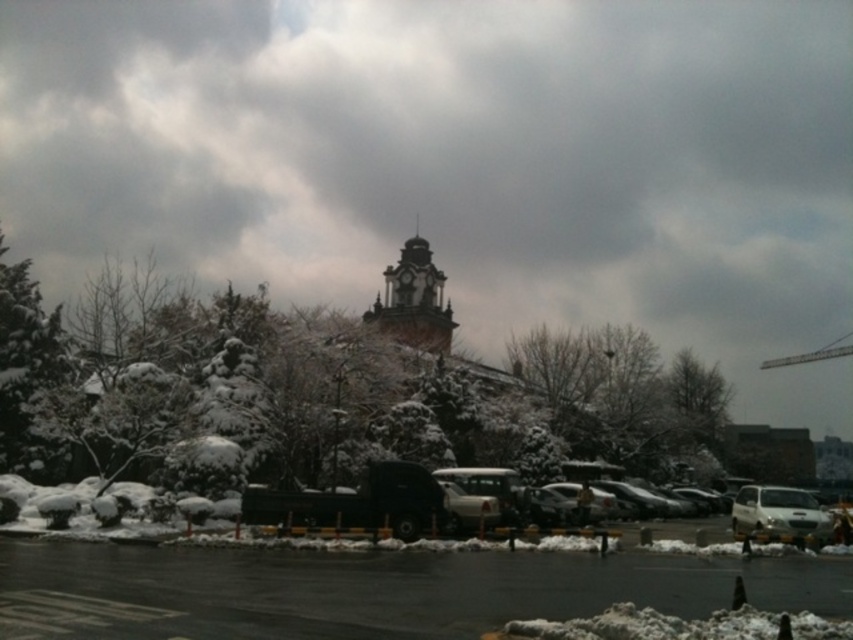
Consider the image. You are standing in the parking lot and want to take a photo of the gray cloudy sky at upper center. If you look at the coordinates given, where should you point your camera to capture it?

You should point your camera to the coordinates point at (x=453, y=157) to capture the gray cloudy sky at upper center.